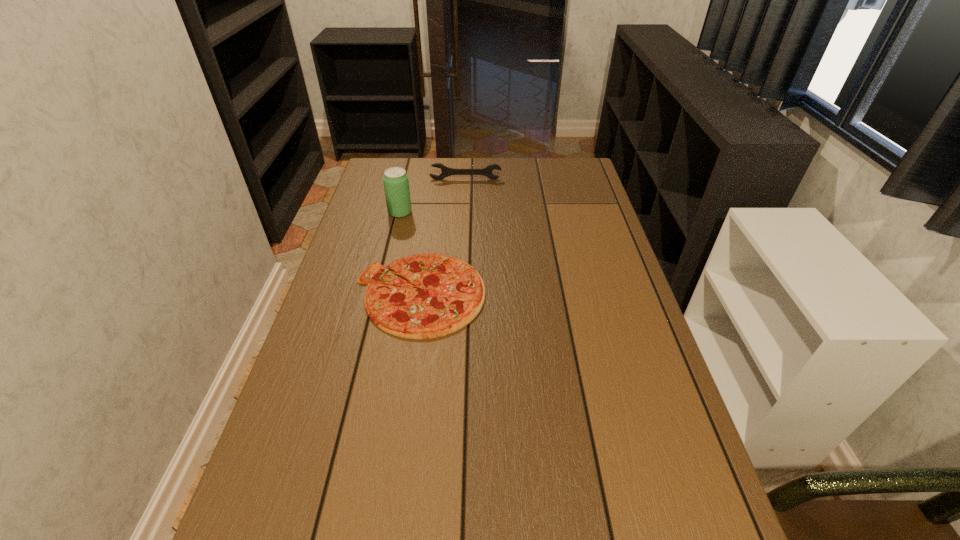
This screenshot has width=960, height=540. In order to click on the second nearest object in this screenshot , I will do `click(396, 185)`.

Find the location of a particular element. This screenshot has width=960, height=540. soda is located at coordinates (396, 185).

This screenshot has width=960, height=540. What are the coordinates of `wrench` in the screenshot? It's located at (445, 171).

Locate an element on the screen. This screenshot has height=540, width=960. the second tallest object is located at coordinates (445, 171).

Where is `the nearest object`? the nearest object is located at coordinates (451, 293).

Locate an element on the screen. The width and height of the screenshot is (960, 540). the shortest object is located at coordinates (451, 293).

This screenshot has width=960, height=540. Find the location of `vacant point located on the back of the tallest object`. vacant point located on the back of the tallest object is located at coordinates (409, 175).

Locate an element on the screen. The height and width of the screenshot is (540, 960). blank space located on the open ends of the wrench is located at coordinates (464, 224).

Find the location of a particular element. This screenshot has width=960, height=540. free space located on the right of the shortest object is located at coordinates (601, 294).

Locate an element on the screen. The width and height of the screenshot is (960, 540). object positioned at the far edge is located at coordinates (445, 171).